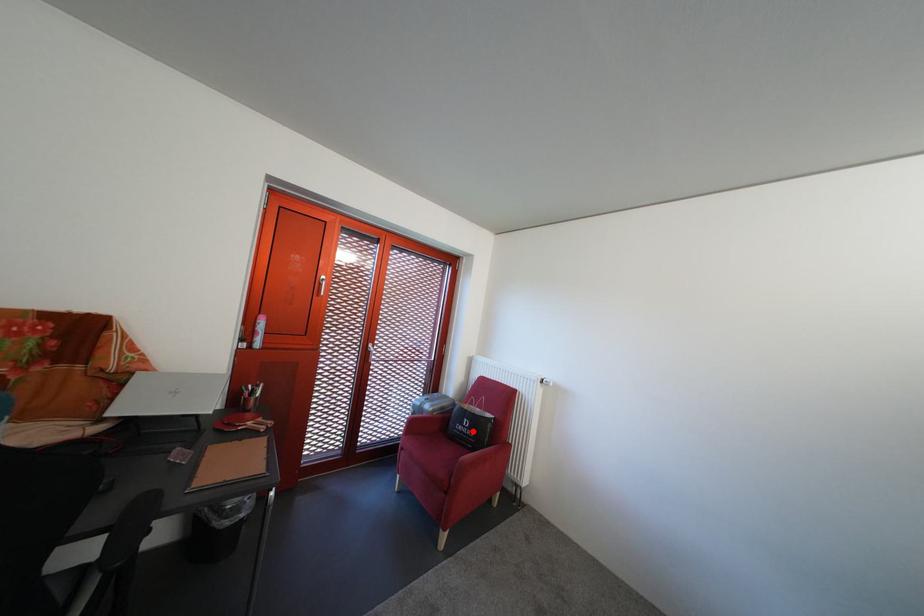
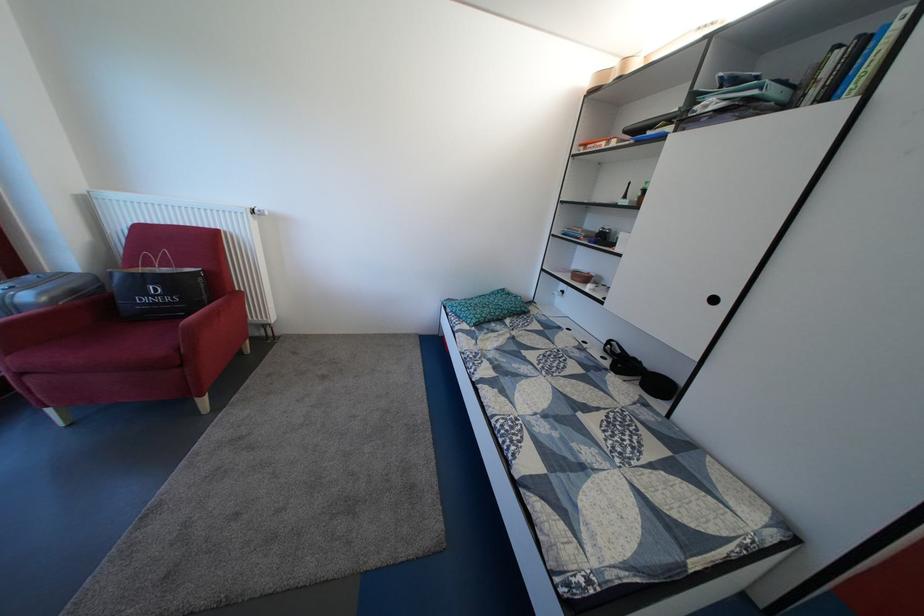
Question: I am providing you with two images of the same scene from different viewpoints. Image1 has a red point marked. In image2, the corresponding 3D location appears at what relative position? Reply with the corresponding letter.

Choices:
 (A) Closer
 (B) Farther

Answer: (A)